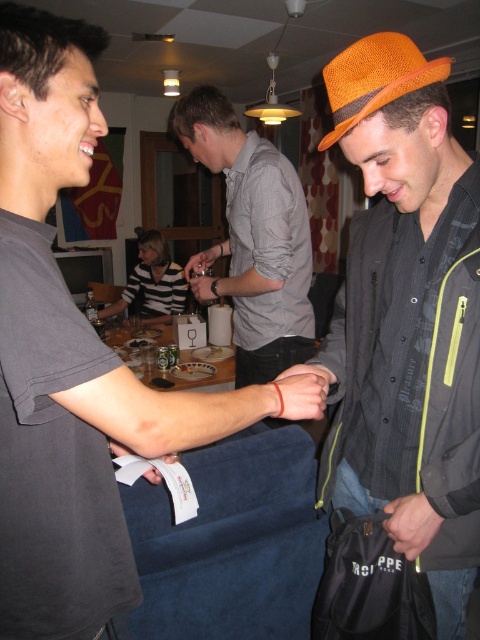
The height and width of the screenshot is (640, 480). Describe the element at coordinates (407, 320) in the screenshot. I see `orange woven hat at right` at that location.

Which is more to the left, orange woven hat at right or orange straw hat at upper right?

orange straw hat at upper right is more to the left.

This screenshot has width=480, height=640. Find the location of `orange woven hat at right`. orange woven hat at right is located at coordinates (407, 320).

Is gray cotton shirt at center shorter than orange straw hat at upper right?

Incorrect, gray cotton shirt at center's height does not fall short of orange straw hat at upper right's.

Can you confirm if gray cotton shirt at center is thinner than orange straw hat at upper right?

No.

Which is behind, point (216, 134) or point (403, 81)?

The point (216, 134) is behind.

You are a GUI agent. You are given a task and a screenshot of the screen. Output one action in this format:
    pyautogui.click(x=<x>, y=<y>)
    Task: Click on the gray cotton shirt at center
    This screenshot has width=480, height=640.
    Given the screenshot: What is the action you would take?
    pyautogui.click(x=252, y=237)

Between matte black shirt at upper left and gray cotton shirt at center, which one appears on the right side from the viewer's perspective?

gray cotton shirt at center is more to the right.

Who is more distant from viewer, (75,420) or (240,275)?

Positioned behind is point (240,275).

Where is `matte black shirt at upper left`? The width and height of the screenshot is (480, 640). matte black shirt at upper left is located at coordinates (74, 362).